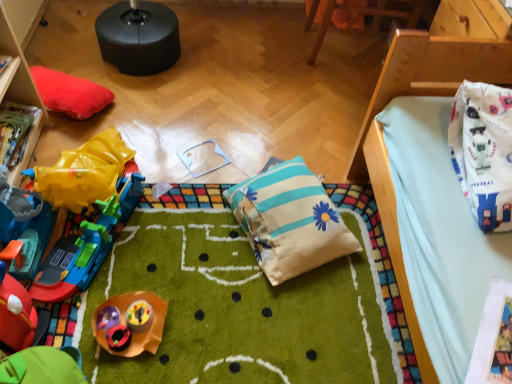
Question: Is striped cotton pillow at center placed right next to rubberized green toy car at lower left, the second toy viewed from the top?

Choices:
 (A) yes
 (B) no

Answer: (B)

Question: Does striped cotton pillow at center have a lesser height compared to rubberized green toy car at lower left, the second toy viewed from the top?

Choices:
 (A) no
 (B) yes

Answer: (B)

Question: From the image's perspective, is striped cotton pillow at center above rubberized green toy car at lower left, the second toy viewed from the top?

Choices:
 (A) yes
 (B) no

Answer: (A)

Question: Is striped cotton pillow at center positioned behind rubberized green toy car at lower left, which ranks as the 2th toy in bottom-to-top order?

Choices:
 (A) no
 (B) yes

Answer: (B)

Question: From the image's perspective, is striped cotton pillow at center located beneath rubberized green toy car at lower left, the second toy viewed from the top?

Choices:
 (A) yes
 (B) no

Answer: (B)

Question: Is point (161, 299) positioned closer to the camera than point (393, 41)?

Choices:
 (A) farther
 (B) closer

Answer: (A)

Question: In terms of height, does plastic toy at center, arranged as the first toy when ordered from the bottom, look taller or shorter compared to white fabric at upper right, placed as the first furniture when sorted from right to left?

Choices:
 (A) tall
 (B) short

Answer: (B)

Question: Considering the positions of plastic toy at center, arranged as the first toy when ordered from the bottom, and white fabric at upper right, positioned as the 3th furniture in left-to-right order, in the image, is plastic toy at center, arranged as the first toy when ordered from the bottom, bigger or smaller than white fabric at upper right, positioned as the 3th furniture in left-to-right order,?

Choices:
 (A) small
 (B) big

Answer: (A)

Question: In the image, is plastic toy at center, marked as the 3th toy in a top-to-bottom arrangement, on the left side or the right side of white fabric at upper right, placed as the first furniture when sorted from right to left?

Choices:
 (A) left
 (B) right

Answer: (A)

Question: Based on their sizes in the image, would you say plastic toy at center, marked as the 3th toy in a top-to-bottom arrangement, is bigger or smaller than white fabric bag at upper right?

Choices:
 (A) small
 (B) big

Answer: (A)

Question: Is point (154, 345) closer or farther from the camera than point (500, 205)?

Choices:
 (A) closer
 (B) farther

Answer: (B)

Question: Considering the positions of plastic toy at center, arranged as the first toy when ordered from the bottom, and white fabric bag at upper right in the image, is plastic toy at center, arranged as the first toy when ordered from the bottom, wider or thinner than white fabric bag at upper right?

Choices:
 (A) wide
 (B) thin

Answer: (A)

Question: Would you say plastic toy at center, arranged as the first toy when ordered from the bottom, is to the left or to the right of white fabric bag at upper right in the picture?

Choices:
 (A) left
 (B) right

Answer: (A)

Question: Do you think striped cotton pillow at center is within rubberized green toy car at lower left, the second toy viewed from the top, or outside of it?

Choices:
 (A) outside
 (B) inside

Answer: (A)

Question: In the image, is striped cotton pillow at center on the left side or the right side of rubberized green toy car at lower left, which ranks as the 2th toy in bottom-to-top order?

Choices:
 (A) left
 (B) right

Answer: (B)